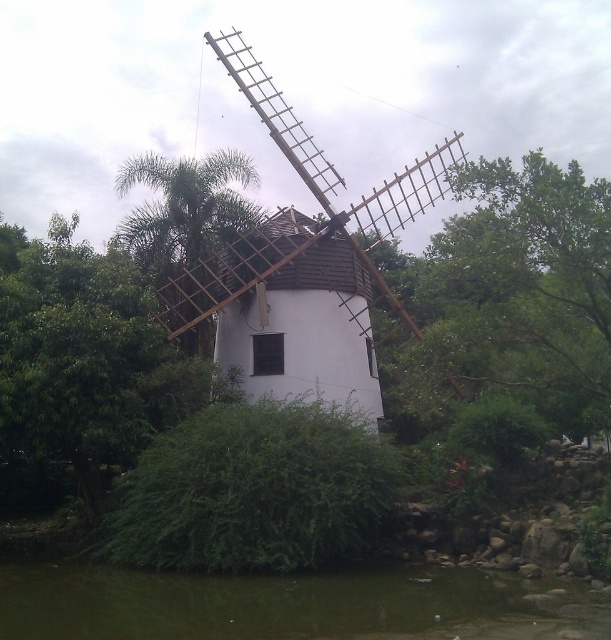
Question: Which object appears closest to the camera in this image?

Choices:
 (A) green leafy tree at left
 (B) green leafy tree at upper right
 (C) green murky water at lower center
 (D) green leafy palm at center

Answer: (C)

Question: Which of these objects is positioned farthest from the white wooden windmill at center?

Choices:
 (A) green leafy tree at upper right
 (B) green murky water at lower center

Answer: (B)

Question: Is white wooden windmill at center smaller than green murky water at lower center?

Choices:
 (A) no
 (B) yes

Answer: (A)

Question: Is green murky water at lower center smaller than green leafy palm at center?

Choices:
 (A) no
 (B) yes

Answer: (B)

Question: Which object is closer to the camera taking this photo?

Choices:
 (A) green leafy tree at upper right
 (B) green leafy tree at left
 (C) white wooden windmill at center

Answer: (A)

Question: Can you confirm if white wooden windmill at center is bigger than green leafy palm at center?

Choices:
 (A) yes
 (B) no

Answer: (A)